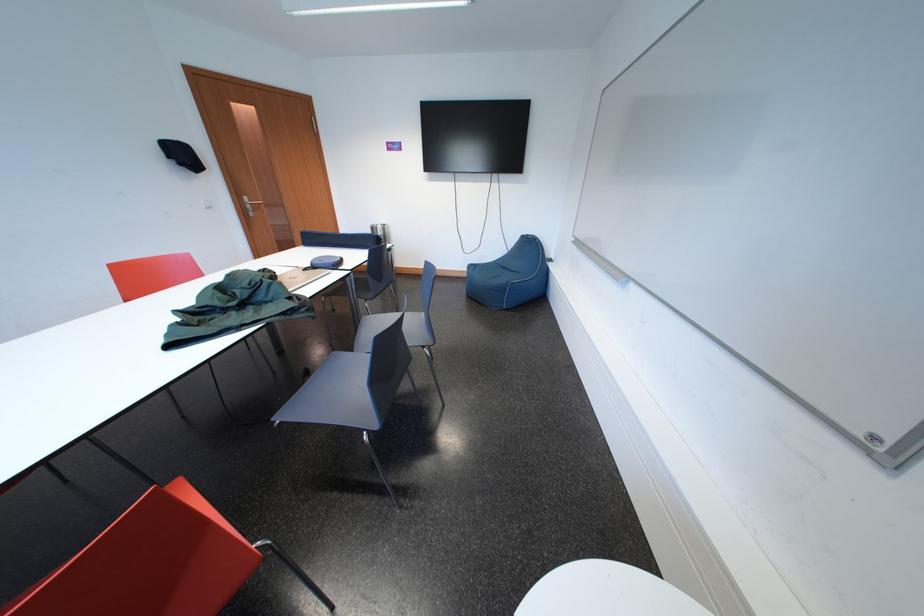
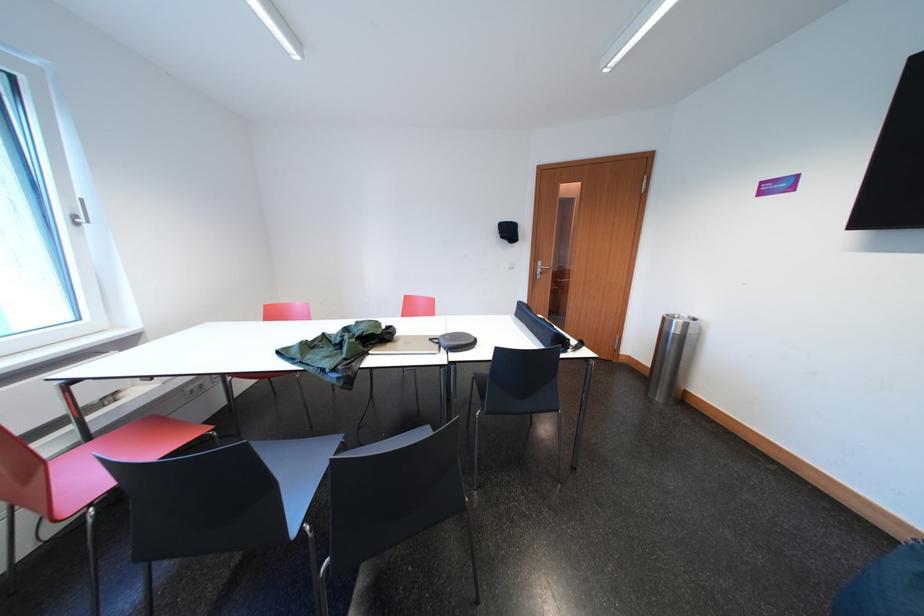
The point at [375,262] is marked in the first image. Where is the corresponding point in the second image?

(499, 361)